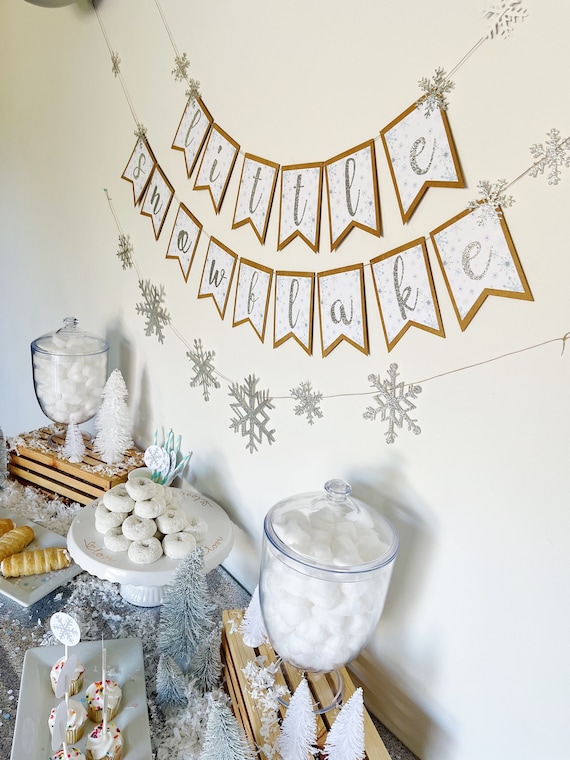
The width and height of the screenshot is (570, 760). What are the coordinates of `fake tree decorations` in the screenshot? It's located at (221, 738), (173, 678), (176, 600), (306, 723), (340, 726), (74, 447), (109, 447).